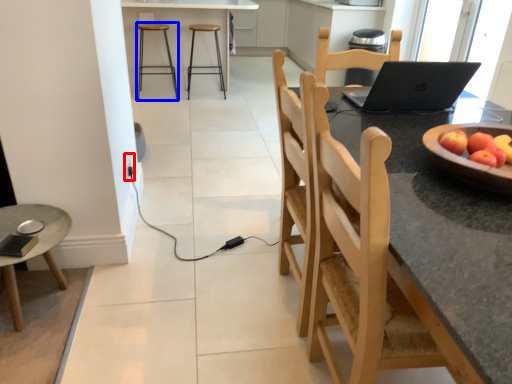
Question: Which of the following is the closest to the observer, electric outlet (highlighted by a red box) or stool (highlighted by a blue box)?

Choices:
 (A) electric outlet
 (B) stool

Answer: (A)